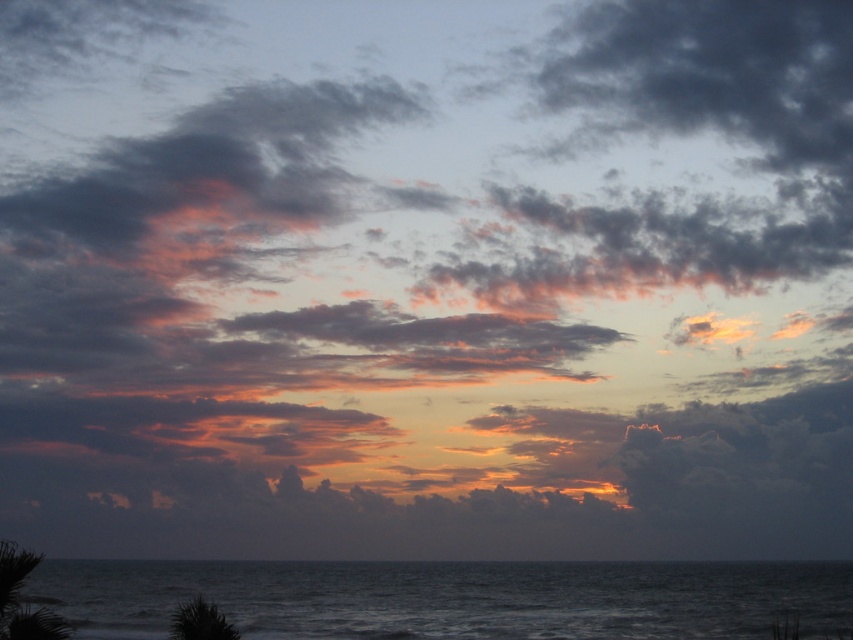
You are standing on a beach and see the dark blue water at lower center and the green leafy palm tree at lower left. Which object takes up more horizontal space in the image?

The dark blue water at lower center takes up more horizontal space than the green leafy palm tree at lower left because its width surpasses the palm tree.

You are standing at the edge of the water and want to place a buoy exactly at the location of the dark blue water at lower center. According to the coordinates provided, where should you place the buoy?

The dark blue water at lower center is located at point (x=450, y=598), so you should place the buoy at those coordinates.